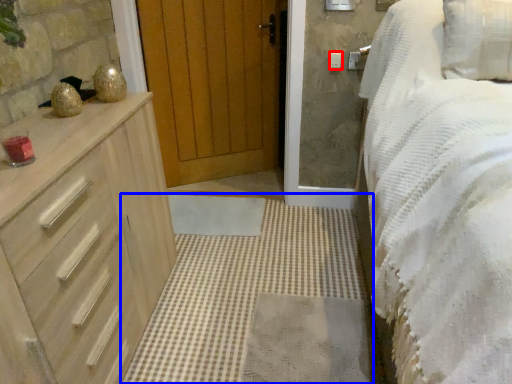
Question: Which object appears closest to the camera in this image, light switch (highlighted by a red box) or plain (highlighted by a blue box)?

Choices:
 (A) light switch
 (B) plain

Answer: (B)